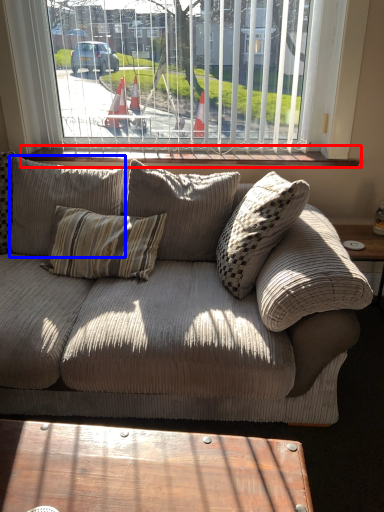
Question: Among these objects, which one is nearest to the camera, window sill (highlighted by a red box) or pillow (highlighted by a blue box)?

Choices:
 (A) window sill
 (B) pillow

Answer: (B)